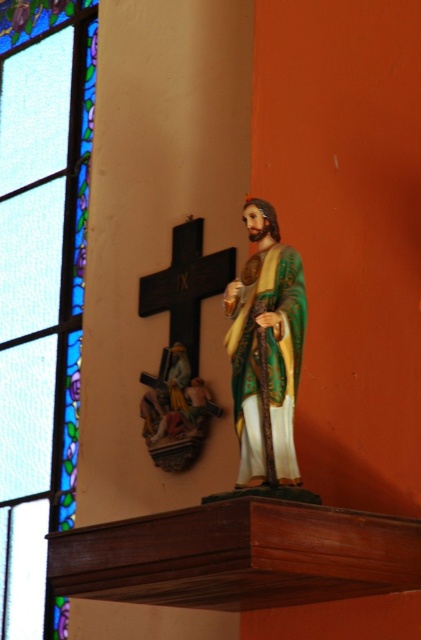
Question: Based on their relative distances, which object is nearer to the shiny green statue at center?

Choices:
 (A) brown polished wood altar at center
 (B) stained glass at upper left

Answer: (A)

Question: Among these objects, which one is nearest to the camera?

Choices:
 (A) shiny green statue at center
 (B) stained glass at upper left

Answer: (A)

Question: Does stained glass at upper left have a greater width compared to brown polished wood altar at center?

Choices:
 (A) no
 (B) yes

Answer: (A)

Question: Among these objects, which one is farthest from the camera?

Choices:
 (A) brown polished wood altar at center
 (B) shiny green statue at center
 (C) stained glass at upper left

Answer: (C)

Question: Is brown polished wood altar at center to the right of shiny green statue at center from the viewer's perspective?

Choices:
 (A) no
 (B) yes

Answer: (A)

Question: Can you confirm if stained glass at upper left is positioned above shiny green statue at center?

Choices:
 (A) yes
 (B) no

Answer: (A)